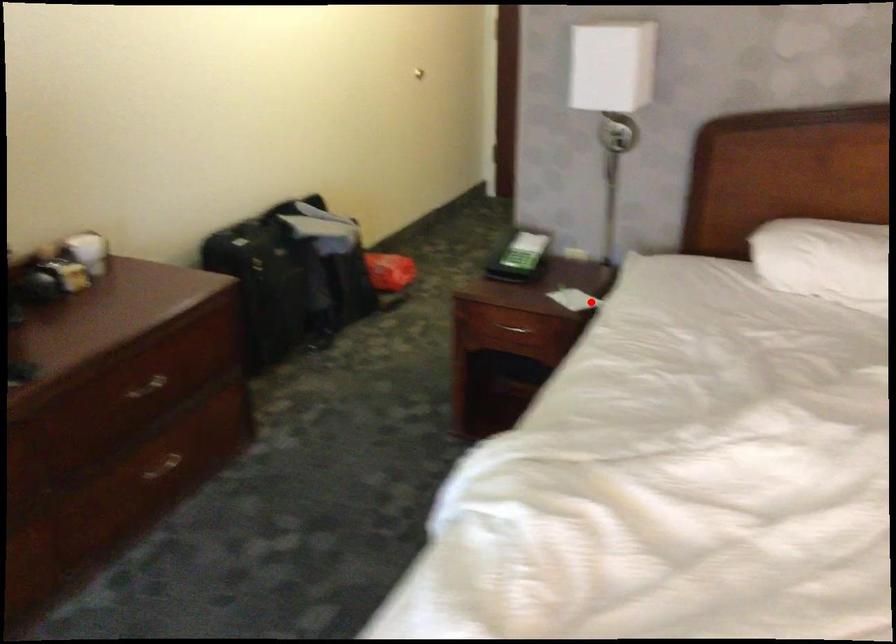
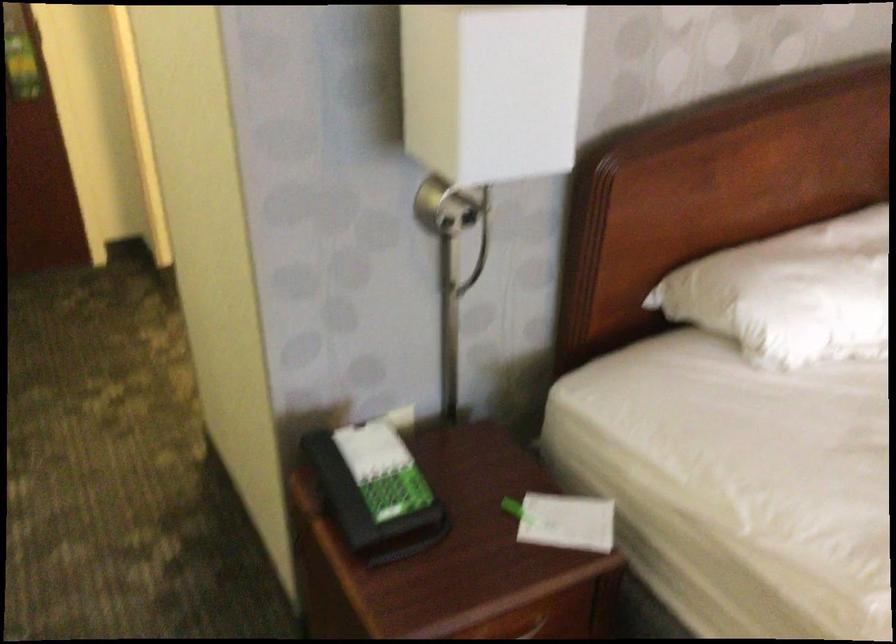
The point at the highlighted location is marked in the first image. Where is the corresponding point in the second image?

(566, 522)